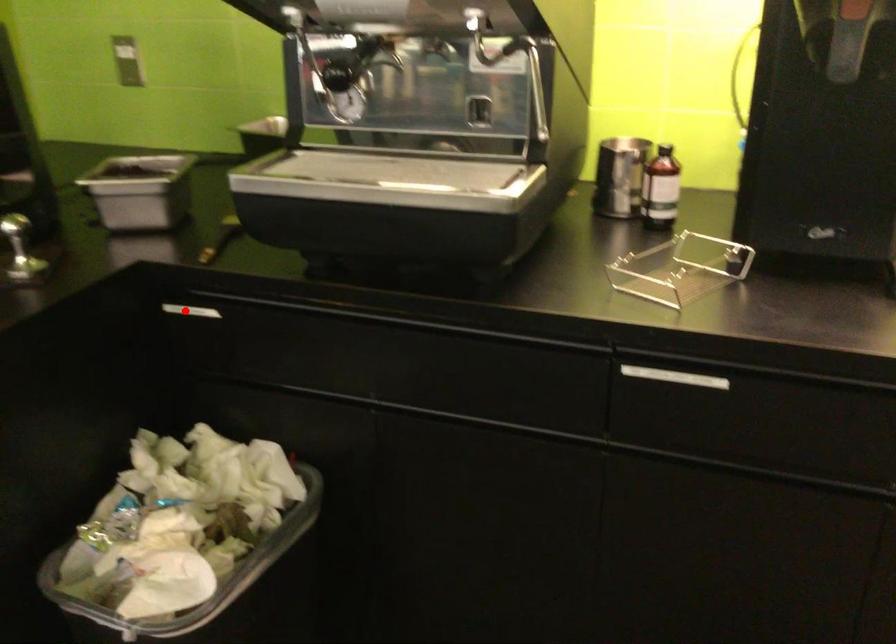
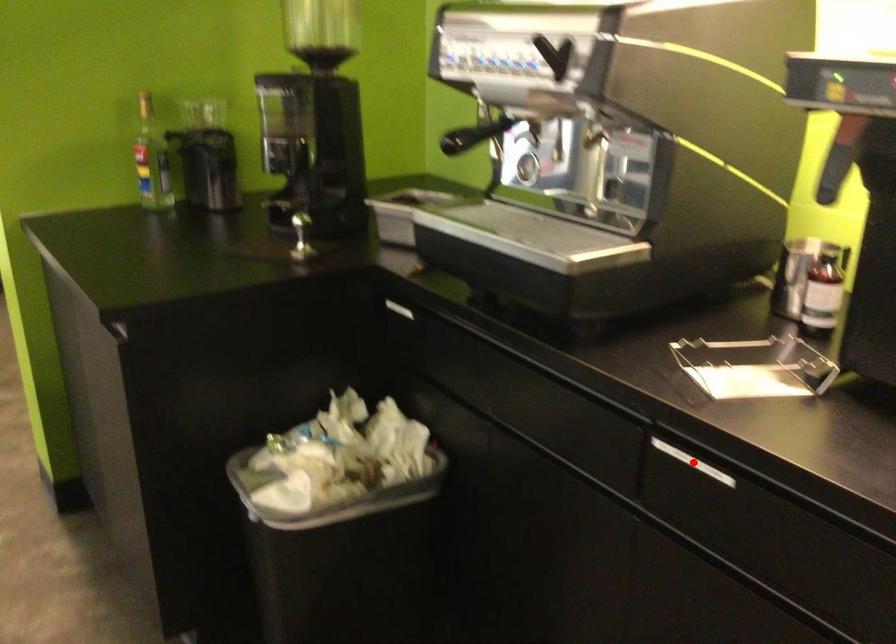
I am providing you with two images of the same scene from different viewpoints. A red point is marked on the first image and another point is marked on the second image. Is the red point in image1 aligned with the point shown in image2?

No